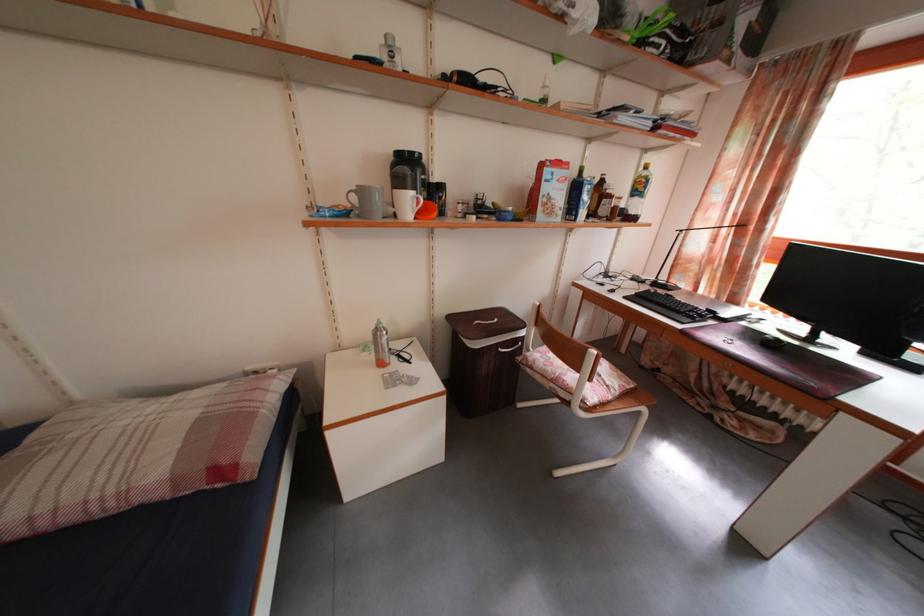
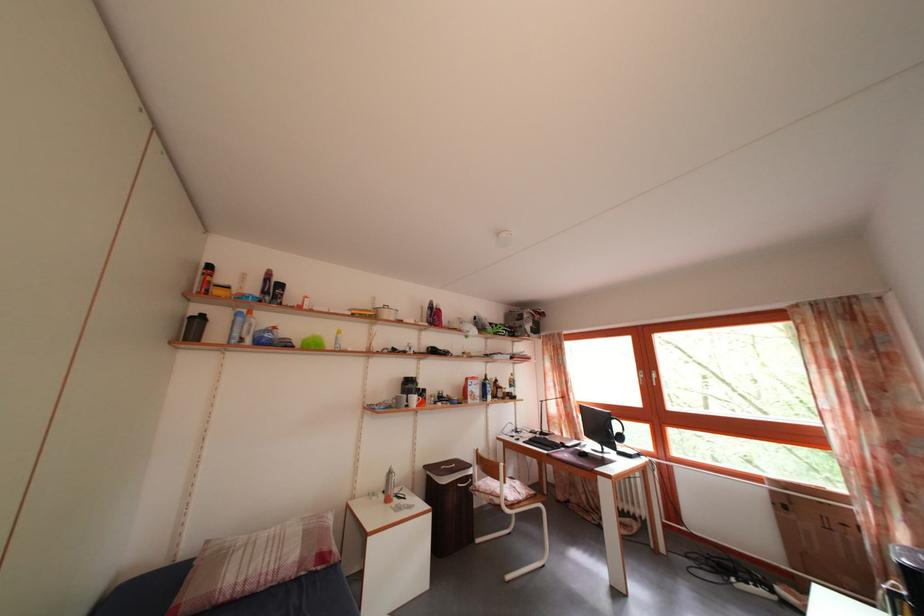
Find the pixel in the second image that matches point (78, 527) in the first image.

(257, 594)